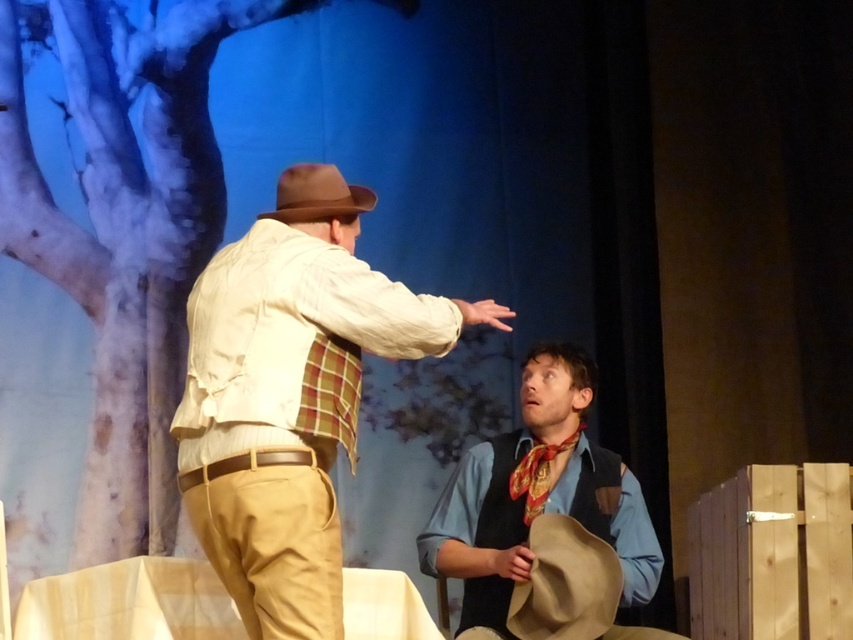
Does light beige cotton shirt at center have a greater height compared to blue denim shirt at center?

Yes.

Which is in front, point (257, 522) or point (485, 522)?

Positioned in front is point (257, 522).

The width and height of the screenshot is (853, 640). What are the coordinates of `light beige cotton shirt at center` in the screenshot? It's located at (289, 406).

Which of these two, brown felt cowboy hat at lower center or red silk necktie at center, stands taller?

brown felt cowboy hat at lower center is taller.

Is brown felt cowboy hat at lower center wider than red silk necktie at center?

Correct, the width of brown felt cowboy hat at lower center exceeds that of red silk necktie at center.

Is point (540, 608) farther from viewer compared to point (550, 452)?

No, it is in front of (550, 452).

I want to click on brown felt cowboy hat at lower center, so click(x=566, y=582).

Who is positioned more to the right, blue denim shirt at center or brown felt cowboy hat at lower center?

brown felt cowboy hat at lower center

Is point (537, 488) farther from camera compared to point (608, 580)?

Yes, it is behind point (608, 580).

Measure the distance between point (x=509, y=468) and camera.

Point (x=509, y=468) is 11.92 feet from camera.

Identify the location of blue denim shirt at center. (537, 493).